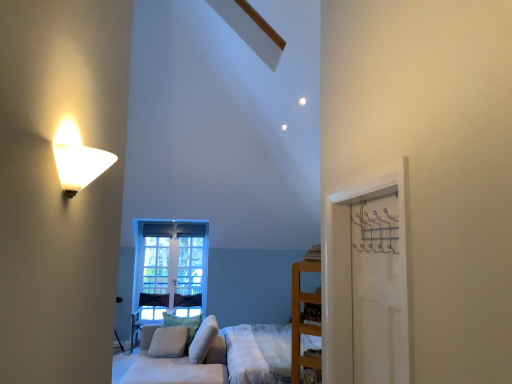
Identify the location of wooden shelf at right. (302, 319).

Measure the distance between point (371, 246) and camera.

They are 6.16 feet apart.

What do you see at coordinates (77, 159) in the screenshot? I see `white matte lampshade at upper left` at bounding box center [77, 159].

You are a GUI agent. You are given a task and a screenshot of the screen. Output one action in this format:
    pyautogui.click(x=<x>, y=<y>)
    Task: Click on the clear glass window at center
    
    Given the screenshot: What is the action you would take?
    pyautogui.click(x=170, y=266)

The height and width of the screenshot is (384, 512). Describe the element at coordinates (170, 266) in the screenshot. I see `clear glass window at center` at that location.

Locate an element on the screen. Image resolution: width=512 pixels, height=384 pixels. white matte door at right is located at coordinates (379, 290).

Identify the location of wooden shelf at right. [x=302, y=319].

From a real-world perspective, relative to white soft pillow at center, positioned as the second pillow in left-to-right order, is wooden shelf at right vertically above or below?

From a real-world perspective, wooden shelf at right is physically above white soft pillow at center, positioned as the second pillow in left-to-right order.

Between point (292, 278) and point (199, 318), which one is positioned in front?

Positioned in front is point (292, 278).

Is wooden shelf at right bigger than white soft pillow at center, positioned as the second pillow in left-to-right order?

No, wooden shelf at right is not bigger than white soft pillow at center, positioned as the second pillow in left-to-right order.

I want to click on furniture in front of the white soft pillow at center, positioned as the second pillow in left-to-right order, so click(x=302, y=319).

Does point (381, 252) come closer to viewer compared to point (200, 352)?

Yes, it is in front of point (200, 352).

What's the angular difference between white matte door at right and white soft pillow at center, which is the 3th pillow in left-to-right order,'s facing directions?

The angle between the facing direction of white matte door at right and the facing direction of white soft pillow at center, which is the 3th pillow in left-to-right order, is 0.836 degrees.

In terms of height, does white matte door at right look taller or shorter compared to white soft pillow at center, marked as the 1th pillow in a right-to-left arrangement?

Considering their sizes, white matte door at right has more height than white soft pillow at center, marked as the 1th pillow in a right-to-left arrangement.

Can you confirm if white matte door at right is bigger than white soft pillow at center, which is the 3th pillow in left-to-right order?

No.

From a real-world perspective, is wooden bed frame at lower center on top of white soft pillow at center, placed as the 3th pillow when sorted from right to left?

Incorrect, from a real-world perspective, wooden bed frame at lower center is lower than white soft pillow at center, placed as the 3th pillow when sorted from right to left.

Based on the photo, relative to white soft pillow at center, which is counted as the first pillow, starting from the left, is wooden bed frame at lower center in front or behind?

Visually, wooden bed frame at lower center is located in front of white soft pillow at center, which is counted as the first pillow, starting from the left.

From the picture: From the image's perspective, is wooden bed frame at lower center located beneath white soft pillow at center, placed as the 3th pillow when sorted from right to left?

Yes.

Is wooden bed frame at lower center at the right side of white soft pillow at center, which is counted as the first pillow, starting from the left?

Yes, wooden bed frame at lower center is to the right of white soft pillow at center, which is counted as the first pillow, starting from the left.

Is white matte lampshade at upper left further to the viewer compared to white soft pillow at center, marked as the 1th pillow in a right-to-left arrangement?

No, white matte lampshade at upper left is closer to the camera.

Consider the image. From the image's perspective, does white matte lampshade at upper left appear higher than white soft pillow at center, which is the 3th pillow in left-to-right order?

Correct, white matte lampshade at upper left appears higher than white soft pillow at center, which is the 3th pillow in left-to-right order, in the image.

You are a GUI agent. You are given a task and a screenshot of the screen. Output one action in this format:
    pyautogui.click(x=<x>, y=<y>)
    Task: Click on the 1st pillow behind when counting from the white matte lampshade at upper left
    
    Given the screenshot: What is the action you would take?
    pyautogui.click(x=203, y=340)

Is white matte lampshade at upper left positioned beyond the bounds of white soft pillow at center, which is the 3th pillow in left-to-right order?

That's correct, white matte lampshade at upper left is outside of white soft pillow at center, which is the 3th pillow in left-to-right order.

Considering the relative positions of white matte door at right and white soft pillow at center, positioned as the second pillow in left-to-right order, in the image provided, is white matte door at right behind white soft pillow at center, positioned as the second pillow in left-to-right order,?

That is False.

Does white matte door at right appear on the right side of white soft pillow at center, positioned as the second pillow in left-to-right order?

Yes.

From a real-world perspective, between white matte door at right and white soft pillow at center, which is the second pillow from right to left, who is vertically lower?

white soft pillow at center, which is the second pillow from right to left, from a real-world perspective.

Considering the sizes of white matte door at right and white soft pillow at center, which is counted as the first pillow, starting from the left, in the image, is white matte door at right bigger or smaller than white soft pillow at center, which is counted as the first pillow, starting from the left,?

Clearly, white matte door at right is smaller in size than white soft pillow at center, which is counted as the first pillow, starting from the left.

Considering their positions, is white matte door at right located in front of or behind white soft pillow at center, which is counted as the first pillow, starting from the left?

Visually, white matte door at right is located in front of white soft pillow at center, which is counted as the first pillow, starting from the left.

This screenshot has width=512, height=384. Find the location of `door above the white soft pillow at center, which is counted as the first pillow, starting from the left (from the image's perspective)`. door above the white soft pillow at center, which is counted as the first pillow, starting from the left (from the image's perspective) is located at coordinates (379, 290).

Is white matte door at right with white soft pillow at center, placed as the 3th pillow when sorted from right to left?

They are not placed beside each other.

Which of these two, clear glass window at center or white matte lampshade at upper left, is bigger?

With larger size is clear glass window at center.

From the picture: Is clear glass window at center at the right side of white matte lampshade at upper left?

No.

Based on the photo, from the image's perspective, is clear glass window at center above white matte lampshade at upper left?

Actually, clear glass window at center appears below white matte lampshade at upper left in the image.

Find the location of a particular element. The image size is (512, 384). window on the left side of white matte lampshade at upper left is located at coordinates (170, 266).

The image size is (512, 384). In order to click on furniture to the right of white soft pillow at center, which is the second pillow from right to left in this screenshot , I will do `click(302, 319)`.

Locate an element on the screen. Image resolution: width=512 pixels, height=384 pixels. the 1st pillow behind when counting from the white matte door at right is located at coordinates click(203, 340).

Which object lies nearer to the anchor point white soft pillow at center, which is counted as the first pillow, starting from the left, clear glass window at center or wooden shelf at right?

Among the two, clear glass window at center is located nearer to white soft pillow at center, which is counted as the first pillow, starting from the left.

Which object lies further to the anchor point clear glass window at center, white matte lampshade at upper left or white soft pillow at center, which is the 3th pillow in left-to-right order?

The object further to clear glass window at center is white matte lampshade at upper left.

Estimate the real-world distances between objects in this image. Which object is further from white matte door at right, white soft pillow at center, which is the 3th pillow in left-to-right order, or clear glass window at center?

clear glass window at center is further to white matte door at right.

Based on the photo, estimate the real-world distances between objects in this image. Which object is closer to clear glass window at center, metallic silver hanger at right or white matte lampshade at upper left?

metallic silver hanger at right is positioned closer to the anchor clear glass window at center.

When comparing their distances from wooden bed frame at lower center, does white matte lampshade at upper left or clear glass window at center seem further?

white matte lampshade at upper left is positioned further to the anchor wooden bed frame at lower center.

Estimate the real-world distances between objects in this image. Which object is further from white matte door at right, clear glass window at center or white soft pillow at center, which is counted as the first pillow, starting from the left?

The object further to white matte door at right is clear glass window at center.

Looking at the image, which one is located further to white soft pillow at center, which is counted as the first pillow, starting from the left, white matte door at right or wooden shelf at right?

white matte door at right is further to white soft pillow at center, which is counted as the first pillow, starting from the left.

Based on their spatial positions, is white soft pillow at center, placed as the 3th pillow when sorted from right to left, or white matte lampshade at upper left further from white soft pillow at center, marked as the 1th pillow in a right-to-left arrangement?

The object further to white soft pillow at center, marked as the 1th pillow in a right-to-left arrangement, is white matte lampshade at upper left.

The image size is (512, 384). Identify the location of bed frame between wooden shelf at right and white soft pillow at center, which is the 3th pillow in left-to-right order, from front to back. (259, 353).

Identify the location of furniture between white matte lampshade at upper left and clear glass window at center in the front-back direction. Image resolution: width=512 pixels, height=384 pixels. (302, 319).

The height and width of the screenshot is (384, 512). I want to click on hanger between white matte door at right and white soft pillow at center, marked as the 1th pillow in a right-to-left arrangement, along the z-axis, so click(376, 231).

This screenshot has width=512, height=384. Identify the location of door between white matte lampshade at upper left and wooden bed frame at lower center from front to back. coord(379,290).